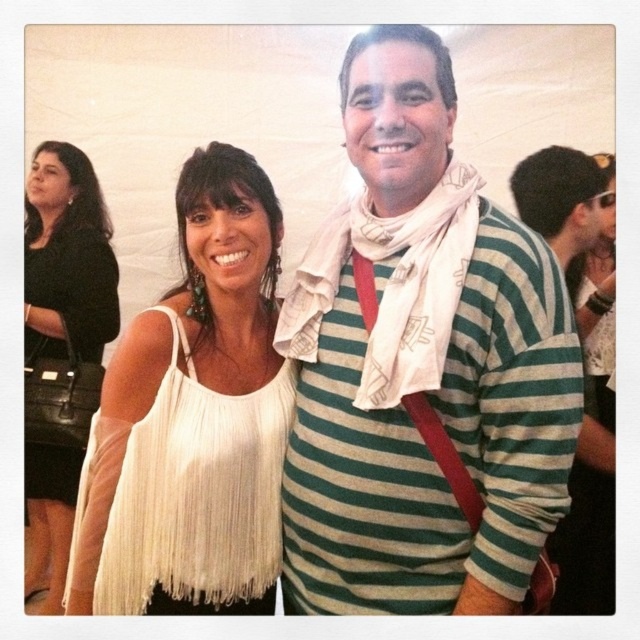
Question: Is green striped shirt at center positioned in front of green striped sweater at center?

Choices:
 (A) no
 (B) yes

Answer: (B)

Question: Estimate the real-world distances between objects in this image. Which object is closer to the black leather purse at left?

Choices:
 (A) green striped shirt at center
 (B) green striped sweater at center
 (C) white textured scarf at center
 (D) white fringed tank top at center

Answer: (D)

Question: Among these points, which one is farthest from the camera?

Choices:
 (A) (67, 456)
 (B) (451, 120)
 (C) (593, 228)
 (D) (378, 234)

Answer: (A)

Question: Is the position of green striped shirt at center more distant than that of green striped sweater at center?

Choices:
 (A) no
 (B) yes

Answer: (A)

Question: Does green striped shirt at center have a greater width compared to black leather purse at left?

Choices:
 (A) no
 (B) yes

Answer: (B)

Question: Which point is farther from the camera taking this photo?

Choices:
 (A) (32, 179)
 (B) (100, 452)

Answer: (A)